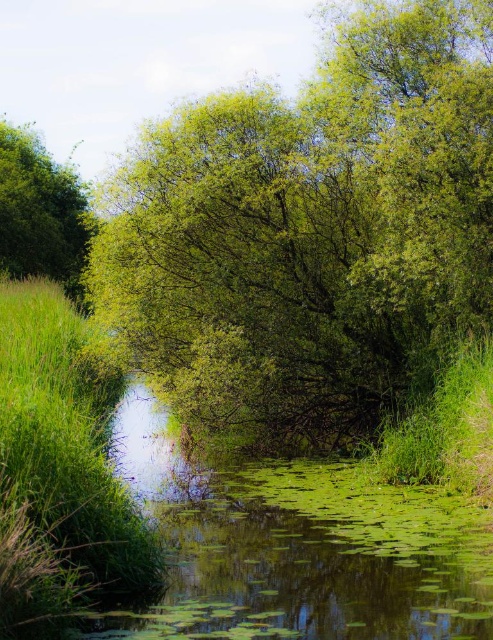
Question: Can you confirm if green grass at left is positioned to the right of green leafy tree at upper left?

Choices:
 (A) no
 (B) yes

Answer: (B)

Question: Can you confirm if green leafy tree at center is thinner than green leafy tree at upper left?

Choices:
 (A) no
 (B) yes

Answer: (A)

Question: Among these points, which one is nearest to the camera?

Choices:
 (A) (28, 147)
 (B) (392, 45)
 (C) (0, 464)

Answer: (C)

Question: In this image, where is green leafy tree at center located relative to green leafy tree at upper left?

Choices:
 (A) above
 (B) below

Answer: (B)

Question: Which of these objects is positioned closest to the green grass at left?

Choices:
 (A) green leafy tree at upper left
 (B) green leafy tree at center

Answer: (B)

Question: Estimate the real-world distances between objects in this image. Which object is closer to the green grass at left?

Choices:
 (A) green leafy tree at upper left
 (B) green leafy tree at center

Answer: (B)